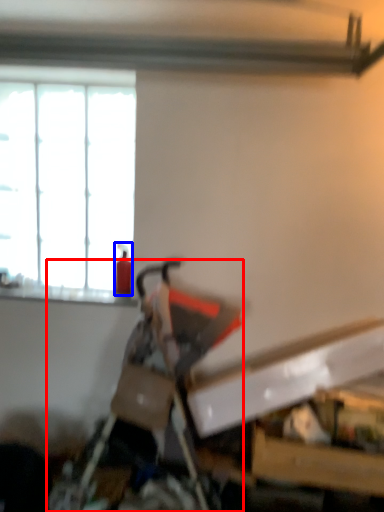
Question: Which object appears closest to the camera in this image, swivel chair (highlighted by a red box) or extinguisher (highlighted by a blue box)?

Choices:
 (A) swivel chair
 (B) extinguisher

Answer: (A)